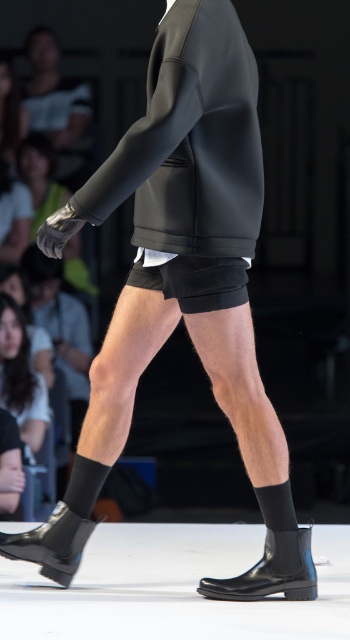
In the scene shown: Is matte black shorts at center positioned in front of black rubber boot at lower left?

Yes, it is.

Who is more forward, (x=226, y=56) or (x=52, y=579)?

Point (x=226, y=56)

Who is more distant from viewer, (192, 100) or (15, 556)?

The point (15, 556) is more distant.

At what (x,y) coordinates should I click in order to perform the action: click on matte black shorts at center. Please return your answer as a coordinate pair (x, y). This screenshot has height=640, width=350. Looking at the image, I should click on (190, 141).

Is matte black shorts at center shorter than black matte shorts at center?

No.

Looking at this image, does matte black shorts at center appear on the left side of black matte shorts at center?

Correct, you'll find matte black shorts at center to the left of black matte shorts at center.

Locate an element on the screen. matte black shorts at center is located at coordinates (190, 141).

Is matte black shorts at center to the left of black leather boot at lower center from the viewer's perspective?

Correct, you'll find matte black shorts at center to the left of black leather boot at lower center.

Can you confirm if matte black shorts at center is bigger than black leather boot at lower center?

Yes, matte black shorts at center is bigger than black leather boot at lower center.

Is point (248, 256) closer to camera compared to point (247, 572)?

No, it is behind (247, 572).

At what (x,y) coordinates should I click in order to perform the action: click on matte black shorts at center. Please return your answer as a coordinate pair (x, y). Image resolution: width=350 pixels, height=640 pixels. Looking at the image, I should click on (190, 141).